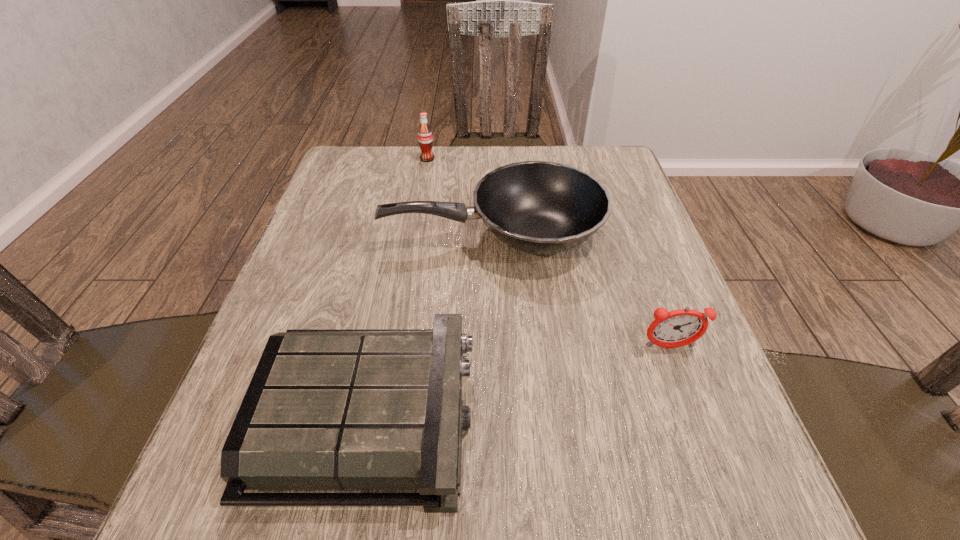
Locate an element on the screen. This screenshot has height=540, width=960. free space between the soda and the shortest object is located at coordinates (398, 288).

At what (x,y) coordinates should I click in order to perform the action: click on free space between the shortest object and the rightmost object. Please return your answer as a coordinate pair (x, y). Looking at the image, I should click on (519, 382).

Locate an element on the screen. This screenshot has width=960, height=540. free point between the alarm clock and the second farthest object is located at coordinates (581, 291).

Identify the location of blank region between the rightmost object and the shortest object. The image size is (960, 540). (519, 382).

Where is `free area in between the radio receiver and the rightmost object`? The width and height of the screenshot is (960, 540). free area in between the radio receiver and the rightmost object is located at coordinates (519, 382).

Find the location of a particular element. empty space between the rightmost object and the third nearest object is located at coordinates (581, 291).

Identify the location of free space that is in between the frying pan and the soda. The width and height of the screenshot is (960, 540). (460, 197).

Locate which object is the second closest to the alarm clock. Please provide its 2D coordinates. Your answer should be formatted as a tuple, i.e. [(x, y)], where the tuple contains the x and y coordinates of a point satisfying the conditions above.

[(327, 409)]

Find the location of a particular element. This screenshot has height=540, width=960. object that ranks as the third closest to the radio receiver is located at coordinates (425, 139).

Locate an element on the screen. The height and width of the screenshot is (540, 960). blank space that satisfies the following two spatial constraints: 1. on the front side of the soda; 2. on the front panel of the shortest object is located at coordinates (385, 417).